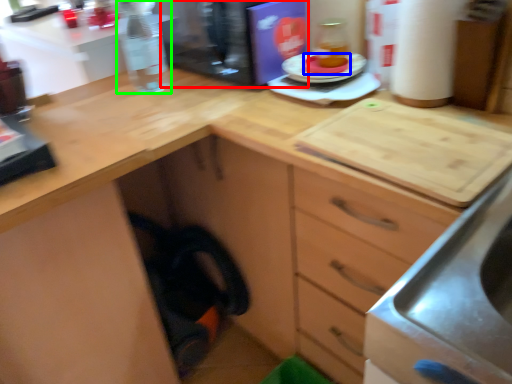
Question: Which object is the farthest from appliance (highlighted by a red box)? Choose among these: food (highlighted by a blue box) or bottle (highlighted by a green box).

Choices:
 (A) food
 (B) bottle

Answer: (A)